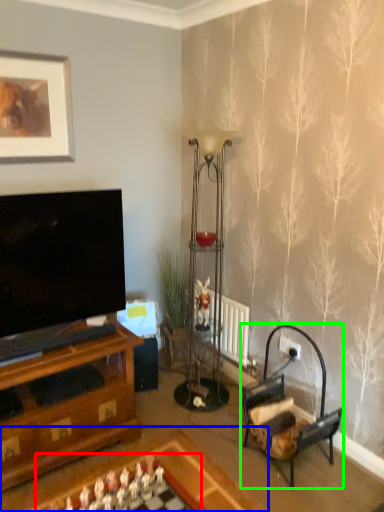
Question: Which object is positioned farthest from board game (highlighted by a red box)? Select from table (highlighted by a blue box) and armchair (highlighted by a green box).

Choices:
 (A) table
 (B) armchair

Answer: (B)